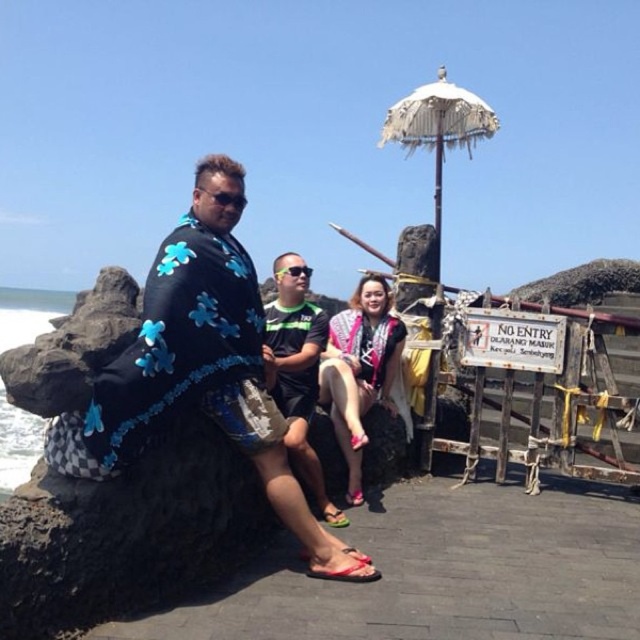
You are standing at the edge of the rocky outcrop looking towards the ocean. Which direction should you move to find the black fabric with blue flowers at center?

The black fabric with blue flowers at center is located at point (209, 360), so you should move towards the center of the rocky outcrop to find it.

You are a photographer trying to capture a clear shot of the black fabric with blue flowers at center and the black fabric shirt at center. Which object should you focus on first to ensure it appears sharp in the foreground?

The black fabric with blue flowers at center is in front of the black fabric shirt at center, so you should focus on the black fabric with blue flowers at center first to ensure it appears sharp in the foreground.